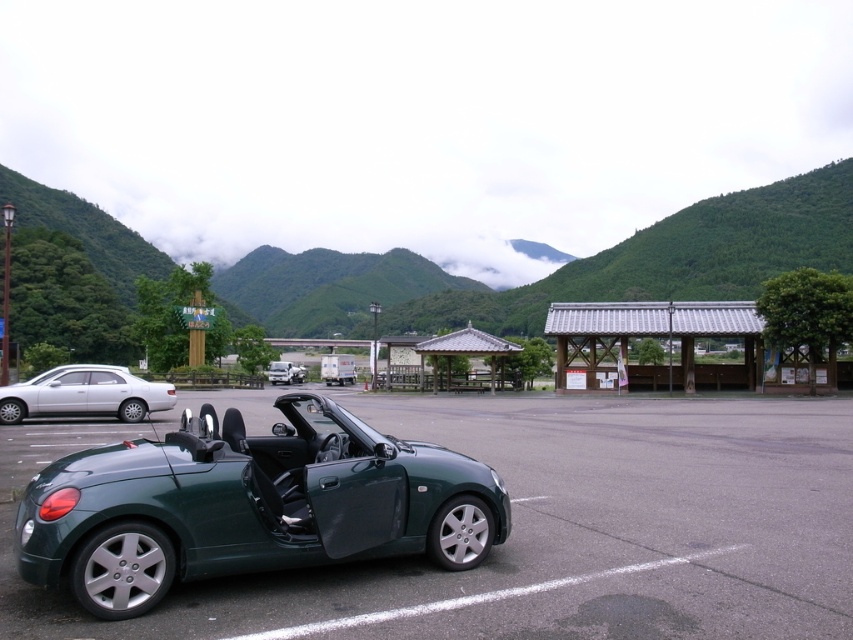
Does point (107, 368) lie behind point (293, 381)?

That is False.

Between point (155, 403) and point (282, 378), which one is positioned in front?

Positioned in front is point (155, 403).

Describe the element at coordinates (84, 394) in the screenshot. This screenshot has height=640, width=853. I see `matte silver sedan at left` at that location.

Find the location of a particular element. The width and height of the screenshot is (853, 640). matte silver sedan at left is located at coordinates (84, 394).

Can you confirm if green matte sports car at center is wider than matte silver sedan at left?

No, green matte sports car at center is not wider than matte silver sedan at left.

Who is taller, green matte sports car at center or matte silver sedan at left?

green matte sports car at center is taller.

Measure the distance between green matte sports car at center and camera.

A distance of 3.98 meters exists between green matte sports car at center and camera.

Where is `green matte sports car at center`? The height and width of the screenshot is (640, 853). green matte sports car at center is located at coordinates (248, 504).

Is point (300, 547) more distant than point (300, 380)?

That is False.

Looking at this image, is the position of green matte sports car at center less distant than that of metallic silver truck at center?

Yes, it is in front of metallic silver truck at center.

Image resolution: width=853 pixels, height=640 pixels. What are the coordinates of `green matte sports car at center` in the screenshot? It's located at (248, 504).